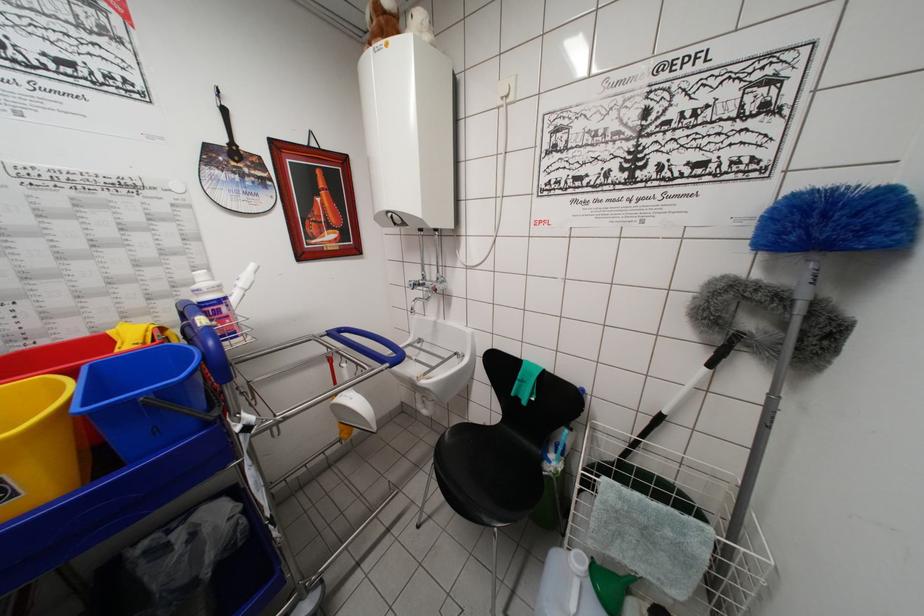
Which object does [382,21] point to?

It refers to a stuffed animal toy.